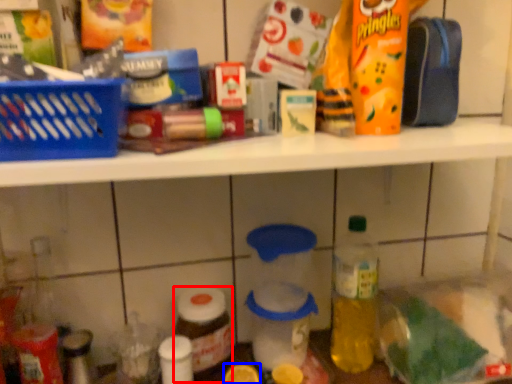
Question: Among these objects, which one is farthest to the camera, bottle (highlighted by a red box) or lemon (highlighted by a blue box)?

Choices:
 (A) bottle
 (B) lemon

Answer: (A)